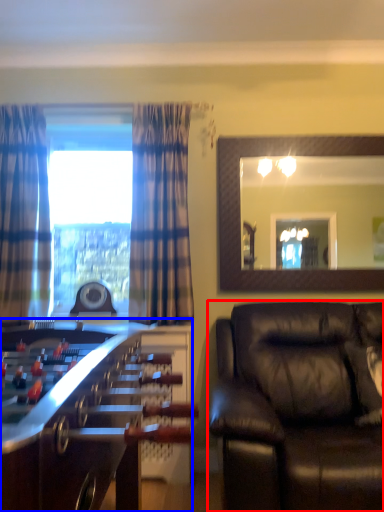
Question: Which of the following is the closest to the observer, studio couch (highlighted by a red box) or table (highlighted by a blue box)?

Choices:
 (A) studio couch
 (B) table

Answer: (B)